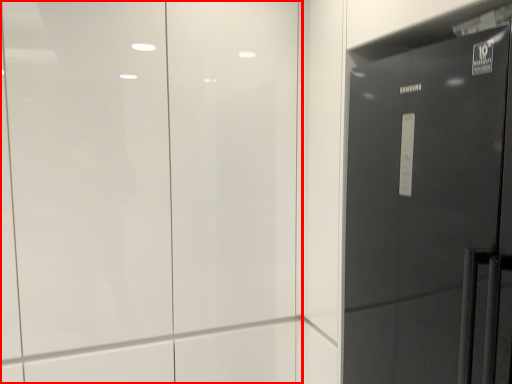
Question: Considering the relative positions of door (annotated by the red box) and door in the image provided, where is door (annotated by the red box) located with respect to the staircase?

Choices:
 (A) left
 (B) right

Answer: (A)